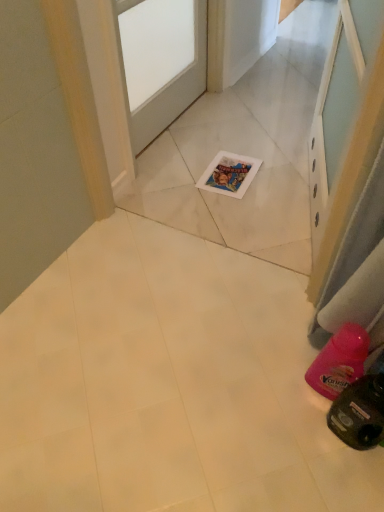
Find the location of `free point behind clear glass screen door at upper center`. free point behind clear glass screen door at upper center is located at coordinates (261, 147).